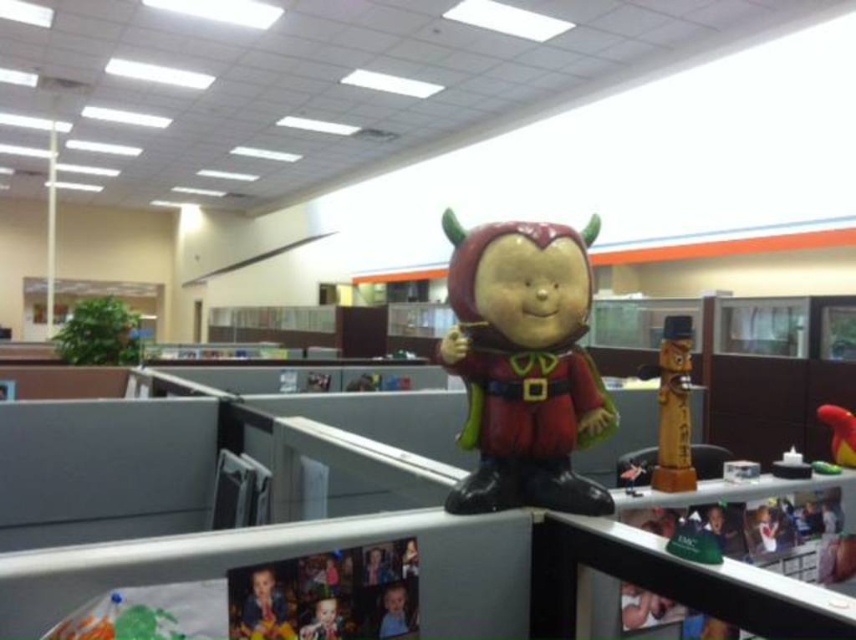
You are an office worker who wants to place a new item on your desk. You have a matte plastic toy at center and a rubber duck at upper center. Which item can you place without blocking the keyboard since it is shorter?

The rubber duck at upper center is shorter than the matte plastic toy at center, so placing the rubber duck at upper center would be less likely to block the keyboard.

You are an office worker who wants to place a new plant between the matte plastic toy at center and the wooden statue at right. Based on their positions, which object should the plant be closer to?

The matte plastic toy at center is closer to the viewer than the wooden statue at right, so the plant should be placed closer to the wooden statue at right to maintain equal distance between both objects.

You are an office worker who wants to place a new plant on your desk. You have a limited space and need to know if the wooden statue at right and the rubber duck at upper center are overlapping. Are they overlapping?

The wooden statue at right is positioned over the rubber duck at upper center, so they are overlapping.